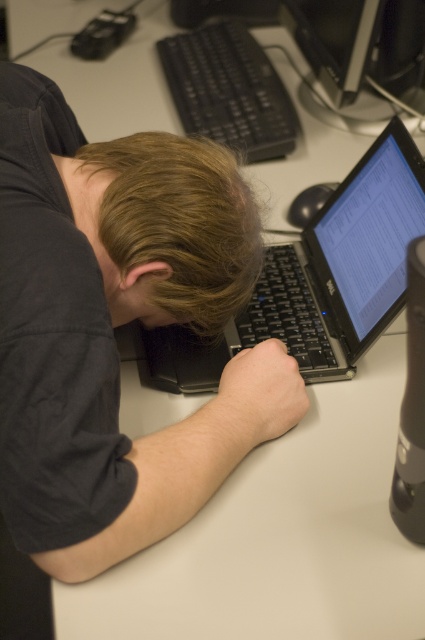
Can you confirm if brown matte hair at center is positioned above smooth skin hand at center?

Yes.

This screenshot has width=425, height=640. Find the location of `brown matte hair at center`. brown matte hair at center is located at coordinates (170, 228).

Is dark gray shirt at center positioned at the back of black plastic keyboard at upper center?

No, dark gray shirt at center is in front of black plastic keyboard at upper center.

Locate an element on the screen. The height and width of the screenshot is (640, 425). dark gray shirt at center is located at coordinates (113, 339).

Is point (268, 420) in front of point (266, 56)?

Yes, point (268, 420) is in front of point (266, 56).

Find the location of a particular element. This screenshot has height=640, width=425. dark gray shirt at center is located at coordinates (113, 339).

Does dark gray shirt at center lie behind black glossy monitor at upper center?

No.

Does dark gray shirt at center have a lesser width compared to black glossy monitor at upper center?

Incorrect, dark gray shirt at center's width is not less than black glossy monitor at upper center's.

This screenshot has height=640, width=425. What do you see at coordinates (113, 339) in the screenshot?
I see `dark gray shirt at center` at bounding box center [113, 339].

Identify the location of dark gray shirt at center. The height and width of the screenshot is (640, 425). (113, 339).